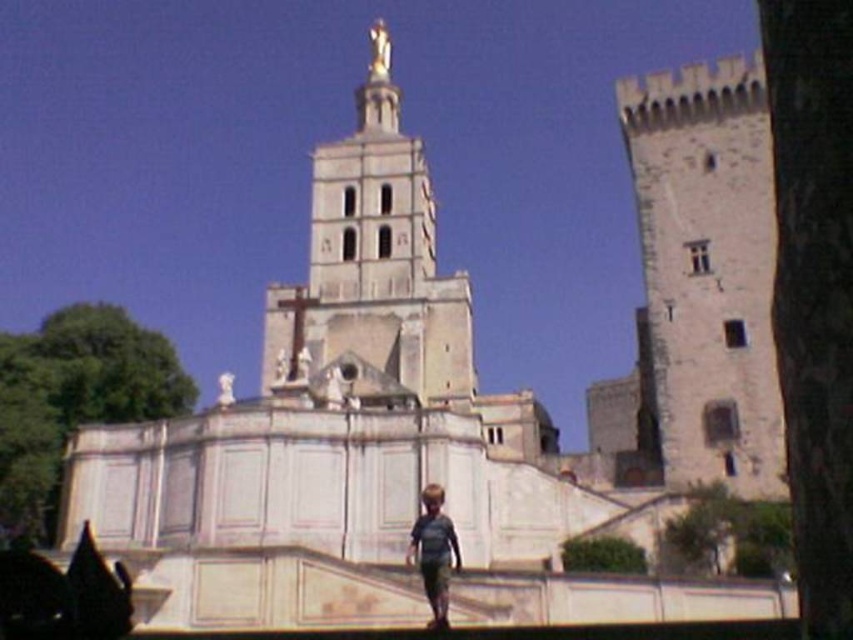
Can you confirm if stone tower at right is positioned above white stone tower at center?

Actually, stone tower at right is below white stone tower at center.

Between stone tower at right and white stone tower at center, which one is positioned lower?

stone tower at right

Which is in front, point (763, 275) or point (392, 230)?

Point (763, 275) is in front.

In order to click on stone tower at right in this screenshot , I will do `click(706, 273)`.

Between stone tower at right and gray cotton shirt at center, which one appears on the left side from the viewer's perspective?

gray cotton shirt at center

Does point (682, 304) come farther from viewer compared to point (431, 509)?

Yes.

Find the location of a particular element. The image size is (853, 640). stone tower at right is located at coordinates (706, 273).

Can you confirm if white stone tower at center is positioned above gray cotton shirt at center?

Correct, white stone tower at center is located above gray cotton shirt at center.

Which of these two, white stone tower at center or gray cotton shirt at center, stands taller?

white stone tower at center

Which is behind, point (314, 269) or point (407, 552)?

Positioned behind is point (314, 269).

Locate an element on the screen. The image size is (853, 640). white stone tower at center is located at coordinates (374, 259).